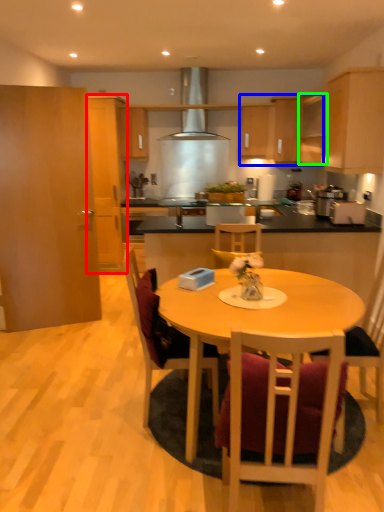
Question: Considering the real-world distances, which object is closest to cabinetry (highlighted by a red box)? cabinetry (highlighted by a blue box) or cabinetry (highlighted by a green box).

Choices:
 (A) cabinetry
 (B) cabinetry

Answer: (A)